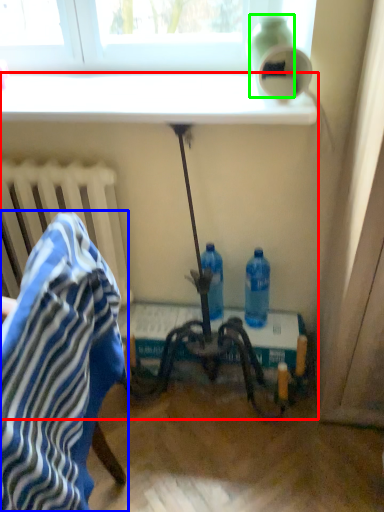
Question: Which object is the farthest from table (highlighted by a red box)? Choose among these: chair (highlighted by a blue box) or bottle (highlighted by a green box).

Choices:
 (A) chair
 (B) bottle

Answer: (A)